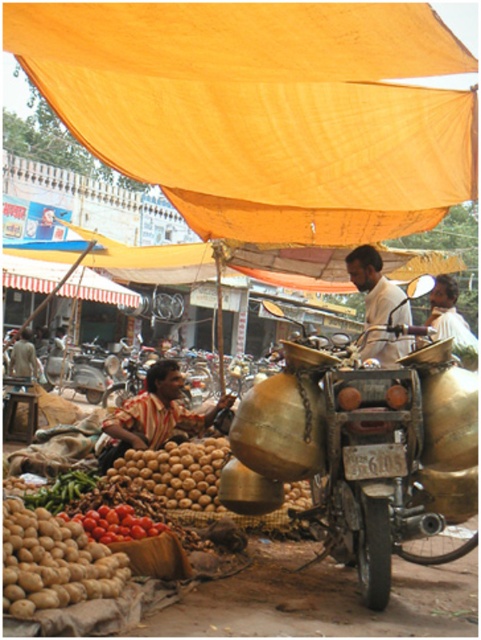
Question: Which is nearer to the white matte shirt at center?

Choices:
 (A) shiny red tomatoes at lower left
 (B) smooth brown potatoes at lower left

Answer: (B)

Question: Is white matte shirt at center below shiny red tomatoes at lower left?

Choices:
 (A) yes
 (B) no

Answer: (B)

Question: Can you confirm if smooth brown potatoes at lower left is wider than white matte shirt at center?

Choices:
 (A) no
 (B) yes

Answer: (B)

Question: Can you confirm if smooth brown potatoes at lower left is positioned to the left of shiny red tomatoes at lower left?

Choices:
 (A) yes
 (B) no

Answer: (B)

Question: Which of the following is the farthest from the observer?

Choices:
 (A) white matte shirt at center
 (B) shiny red tomatoes at lower left
 (C) smooth brown potatoes at lower left

Answer: (C)

Question: Among these points, which one is farthest from the camera?

Choices:
 (A) (119, 536)
 (B) (197, 452)

Answer: (B)